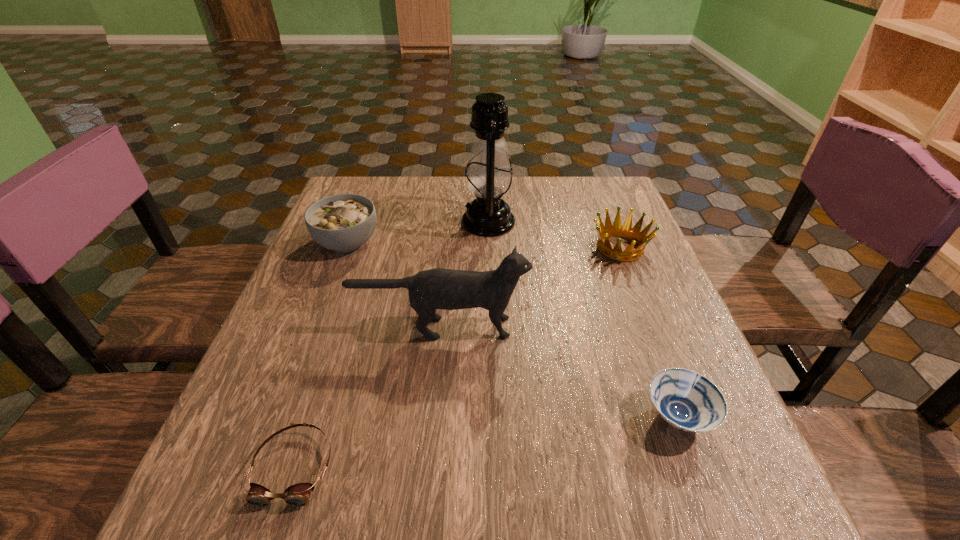
The height and width of the screenshot is (540, 960). Find the location of `vacant area that lies between the oil lamp and the fifth tallest object`. vacant area that lies between the oil lamp and the fifth tallest object is located at coordinates (584, 319).

Find the location of a particular element. The height and width of the screenshot is (540, 960). free space between the fourth shortest object and the nearer soup bowl is located at coordinates (513, 329).

Where is `free space between the second tallest object and the crown`? The width and height of the screenshot is (960, 540). free space between the second tallest object and the crown is located at coordinates (530, 288).

The height and width of the screenshot is (540, 960). Find the location of `vacant space in between the left soup bowl and the goggles`. vacant space in between the left soup bowl and the goggles is located at coordinates (321, 354).

You are a GUI agent. You are given a task and a screenshot of the screen. Output one action in this format:
    pyautogui.click(x=<x>, y=<y>)
    Task: Click on the vacant area that lies between the goggles and the fourth tallest object
    
    Given the screenshot: What is the action you would take?
    pyautogui.click(x=457, y=357)

Where is `object that ranks as the fifth closest to the farther soup bowl`? The image size is (960, 540). object that ranks as the fifth closest to the farther soup bowl is located at coordinates (685, 399).

Where is `the fourth closest object to the fifth shortest object`? This screenshot has width=960, height=540. the fourth closest object to the fifth shortest object is located at coordinates (634, 234).

I want to click on free location that satisfies the following two spatial constraints: 1. on the front side of the oil lamp; 2. on the left side of the right soup bowl, so click(x=493, y=416).

I want to click on free space that satisfies the following two spatial constraints: 1. on the front-facing side of the nearer soup bowl; 2. on the left side of the fifth shortest object, so click(x=432, y=416).

In order to click on free space that satisfies the following two spatial constraints: 1. on the front-facing side of the cat; 2. through the lenses of the goggles in this screenshot , I will do `click(427, 467)`.